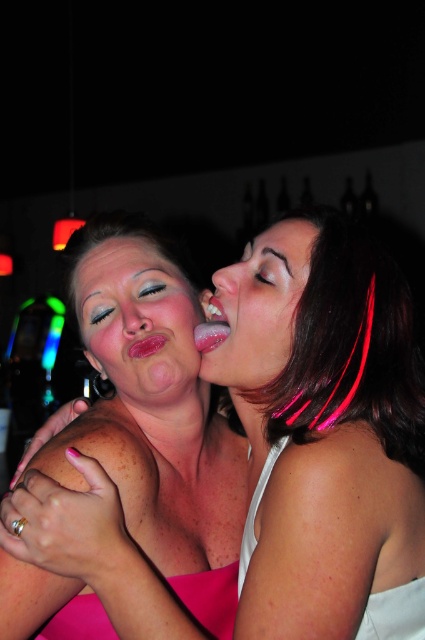
You are a photographer trying to capture the perfect shot of the matte skin face at center and the pink glossy lips at center in this social setting. Since you want both features to appear balanced in size in your photo, which one should you move closer to the camera?

To balance the size of the matte skin face at center and the pink glossy lips at center in the photo, you should move the matte skin face at center closer to the camera because it is currently larger and moving it closer would make it appear even larger, but wait, actually, if the matte skin face is already larger, to balance them, you should move the pink glossy lips at center closer to make it appear larger. Wait, the description says the matte skin face is larger than the lips. To make them appear the 1

You are a photographer adjusting your camera to focus on the two main subjects in the image. You need to ensure that both the satin skin face at center and the pink glossy lips at center are in focus. Given that your camera can only focus on one height at a time, which subject should you prioritize focusing on to ensure the most important feature is sharp?

The satin skin face at center has a greater height compared to the pink glossy lips at center, so you should prioritize focusing on the satin skin face at center to ensure the most important feature is sharp.